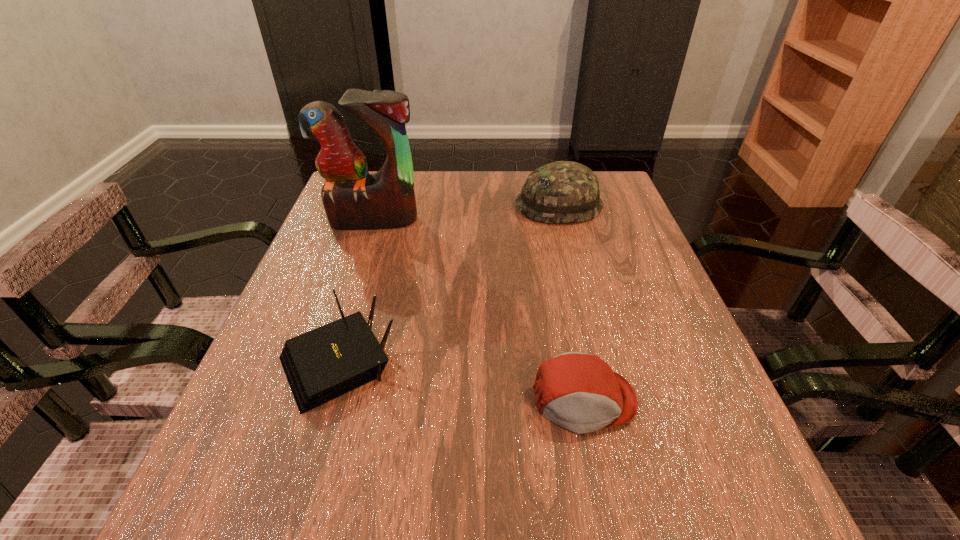
Where is `the third closest object to the tallest object`? This screenshot has height=540, width=960. the third closest object to the tallest object is located at coordinates (580, 392).

What are the coordinates of `free point that satisfies the following two spatial constraints: 1. at the face of the parrot; 2. on the left side of the router` in the screenshot? It's located at (327, 362).